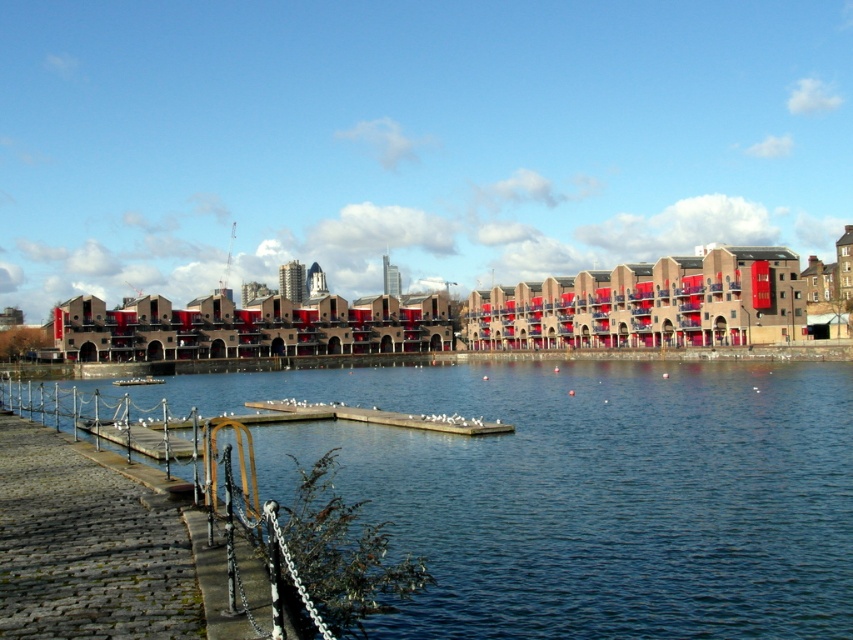
Consider the image. You are a delivery drone that needs to fly over the brown cobblestone dock at lower left and the metallic silver boat at lower left. Based on their heights, which one do you need to fly higher to avoid collision?

The brown cobblestone dock at lower left is taller than the metallic silver boat at lower left, so you need to fly higher to avoid collision with the brown cobblestone dock at lower left.

You are standing on the cobblestone walkway and want to reach the wooden pier. Which dock should you step onto first, the smooth concrete dock at lower left or the brown cobblestone dock at lower left?

You should step onto the smooth concrete dock at lower left first because it is positioned over the brown cobblestone dock at lower left, making it the closer one to your current position on the cobblestone walkway.